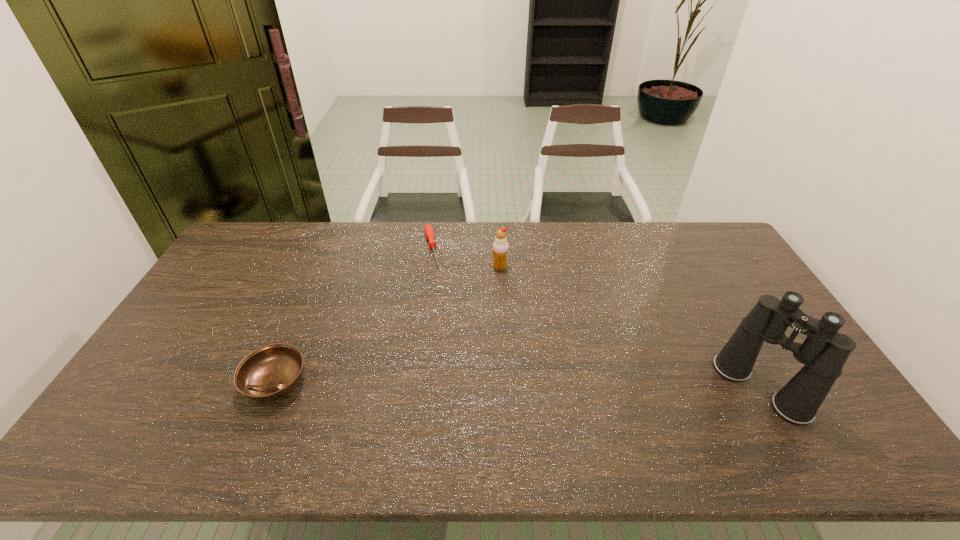
Locate an element on the screen. The image size is (960, 540). the third tallest object is located at coordinates (269, 373).

In order to click on soup bowl in this screenshot , I will do click(x=269, y=373).

Find the location of `binoculars`. binoculars is located at coordinates (824, 352).

Find the location of `the rightmost object`. the rightmost object is located at coordinates (824, 352).

At what (x,y) coordinates should I click in order to perform the action: click on the second tallest object. Please return your answer as a coordinate pair (x, y). The width and height of the screenshot is (960, 540). Looking at the image, I should click on (500, 246).

Locate an element on the screen. The width and height of the screenshot is (960, 540). the second object from right to left is located at coordinates (500, 246).

In order to click on the second object from left to right in this screenshot , I will do `click(429, 232)`.

Identify the location of the shortest object. (429, 232).

Locate an element on the screen. This screenshot has height=540, width=960. free spot located 0.390m on the back of the soup bowl is located at coordinates (324, 268).

At what (x,y) coordinates should I click in order to perform the action: click on vacant area situated 0.090m on the left of the rightmost object. Please return your answer as a coordinate pair (x, y). The width and height of the screenshot is (960, 540). Looking at the image, I should click on (688, 388).